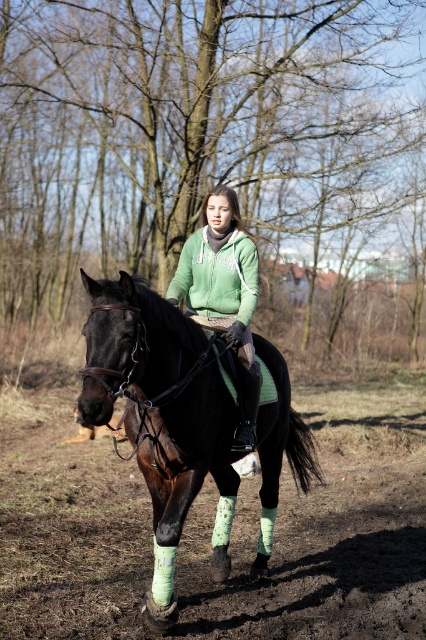
Question: Does dull brown dirt at lower center have a larger size compared to green fleece jacket at center?

Choices:
 (A) yes
 (B) no

Answer: (A)

Question: Estimate the real-world distances between objects in this image. Which object is farther from the shiny black horse at center?

Choices:
 (A) dull brown dirt at lower center
 (B) green fleece jacket at center

Answer: (A)

Question: Estimate the real-world distances between objects in this image. Which object is closer to the shiny black horse at center?

Choices:
 (A) dull brown dirt at lower center
 (B) green fleece jacket at center

Answer: (B)

Question: Where is dull brown dirt at lower center located in relation to shiny black horse at center in the image?

Choices:
 (A) below
 (B) above

Answer: (A)

Question: Which point is closer to the camera?

Choices:
 (A) (109, 408)
 (B) (77, 474)

Answer: (A)

Question: Is dull brown dirt at lower center to the right of shiny black horse at center from the viewer's perspective?

Choices:
 (A) no
 (B) yes

Answer: (A)